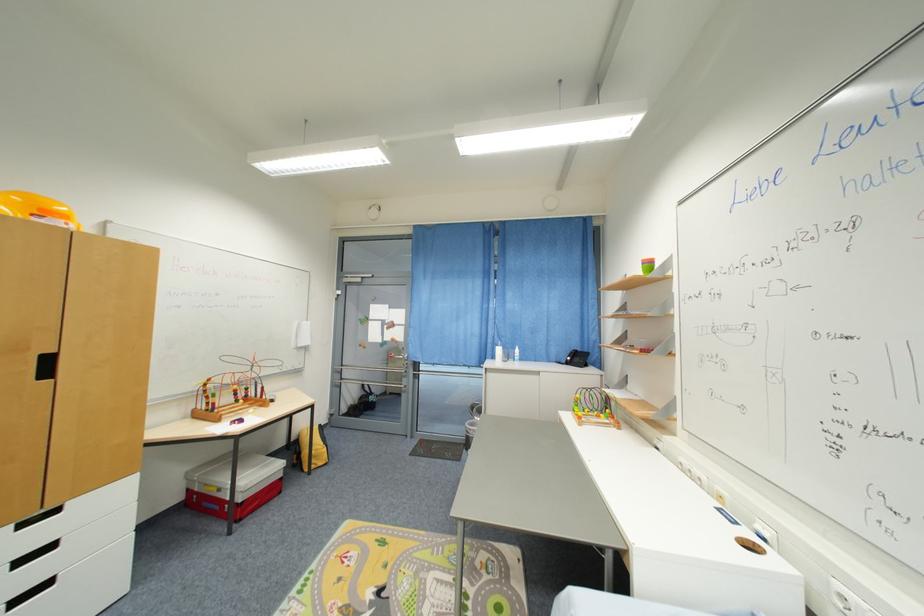
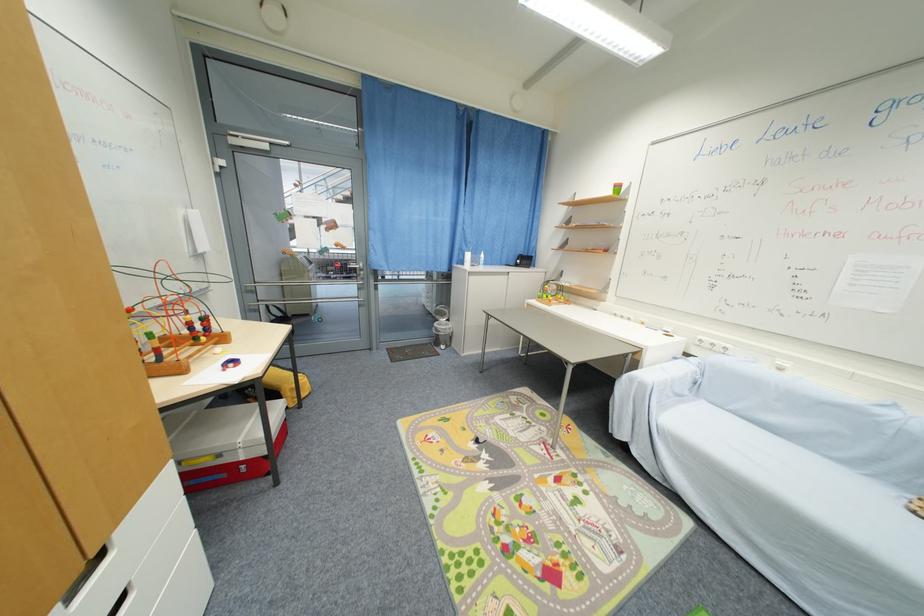
Locate, in the second image, the point that corresponds to (x=499, y=359) in the first image.

(467, 264)